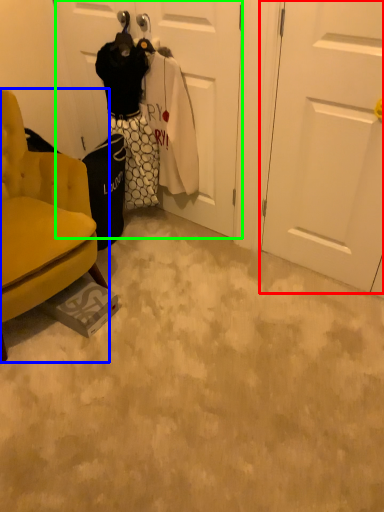
Question: Considering the real-world distances, which object is closest to door (highlighted by a red box)? chair (highlighted by a blue box) or door (highlighted by a green box).

Choices:
 (A) chair
 (B) door

Answer: (B)